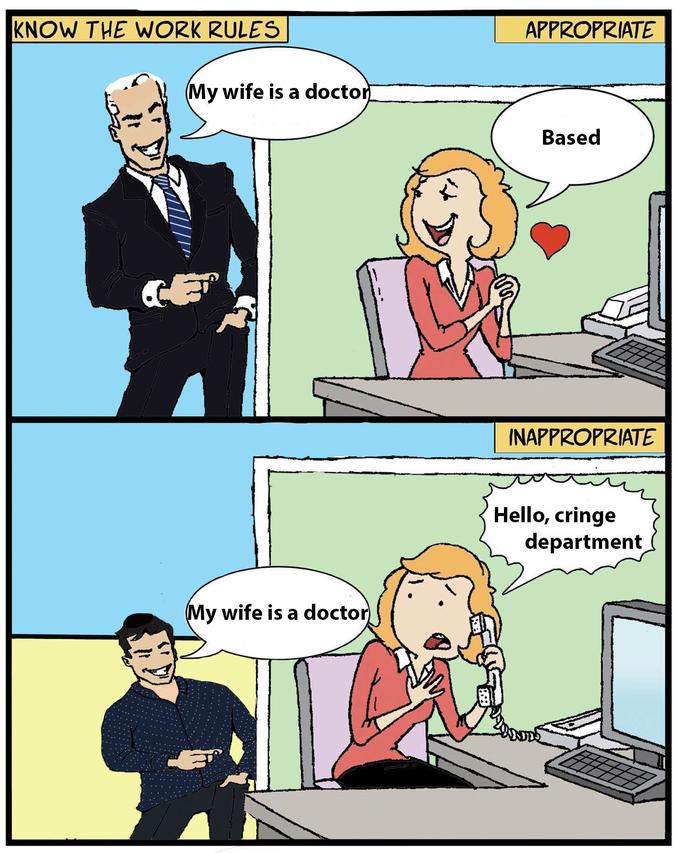
I want to click on frame, so click(371, 467), click(260, 173).